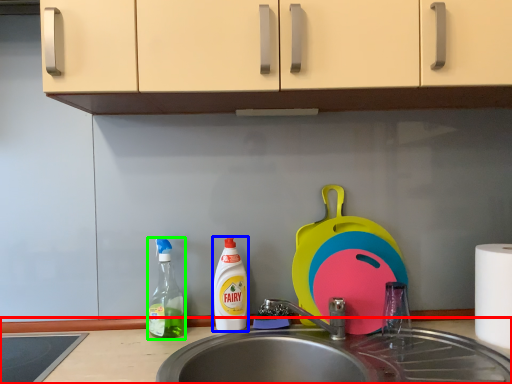
Question: Estimate the real-world distances between objects in this image. Which object is closer to countertop (highlighted by a red box), cleaning product (highlighted by a blue box) or bottle (highlighted by a green box)?

Choices:
 (A) cleaning product
 (B) bottle

Answer: (B)